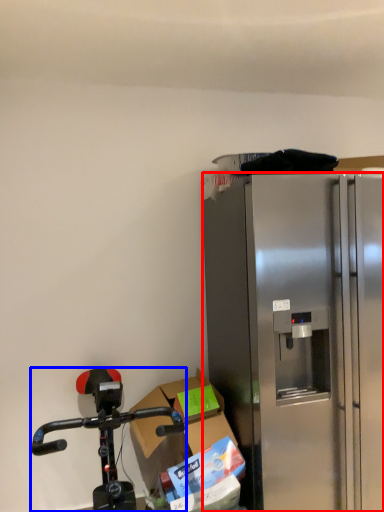
Question: Which point is further to the camera, refrigerator (highlighted by a red box) or bicycle (highlighted by a blue box)?

Choices:
 (A) refrigerator
 (B) bicycle

Answer: (A)